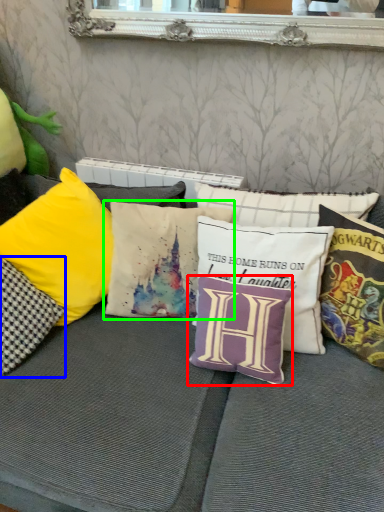
Question: Based on their relative distances, which object is nearer to pillow (highlighted by a red box)? Choose from pillow (highlighted by a blue box) and pillow (highlighted by a green box).

Choices:
 (A) pillow
 (B) pillow

Answer: (B)